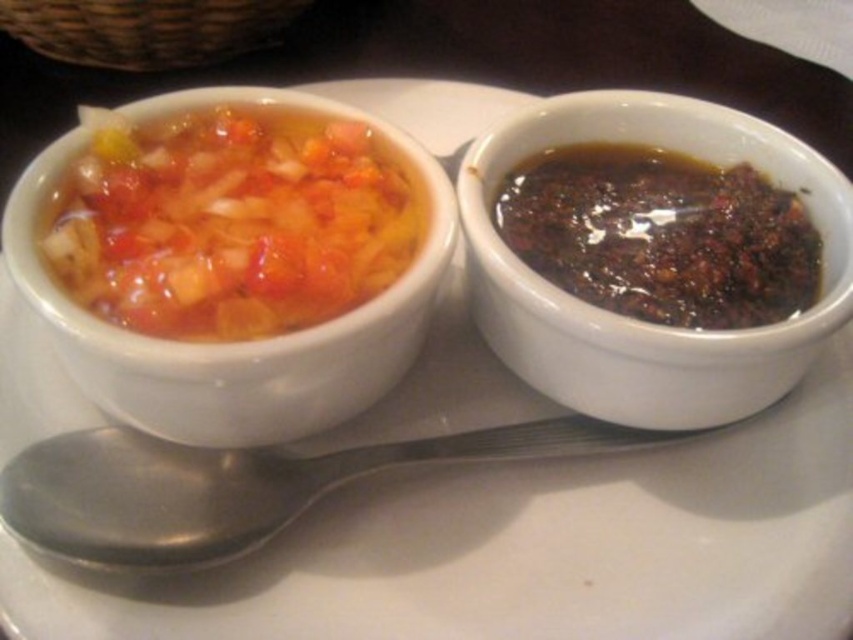
Question: Does black glossy sauce at right appear on the left side of matte ceramic bowl at upper left?

Choices:
 (A) no
 (B) yes

Answer: (A)

Question: Which point appears farthest from the camera in this image?

Choices:
 (A) (94, 440)
 (B) (570, 394)
 (C) (605, 232)
 (D) (289, 381)

Answer: (C)

Question: Does black glossy sauce at right have a lesser width compared to matte ceramic bowl at upper left?

Choices:
 (A) no
 (B) yes

Answer: (B)

Question: Considering the real-world distances, which object is closest to the silver metallic spoon at lower left?

Choices:
 (A) black glossy sauce at right
 (B) dark glossy sauce at right

Answer: (A)

Question: Which of these objects is positioned farthest from the silver metallic spoon at lower left?

Choices:
 (A) black glossy sauce at right
 (B) matte ceramic bowl at upper left

Answer: (A)

Question: Is black glossy sauce at right wider than silver metallic spoon at lower left?

Choices:
 (A) yes
 (B) no

Answer: (B)